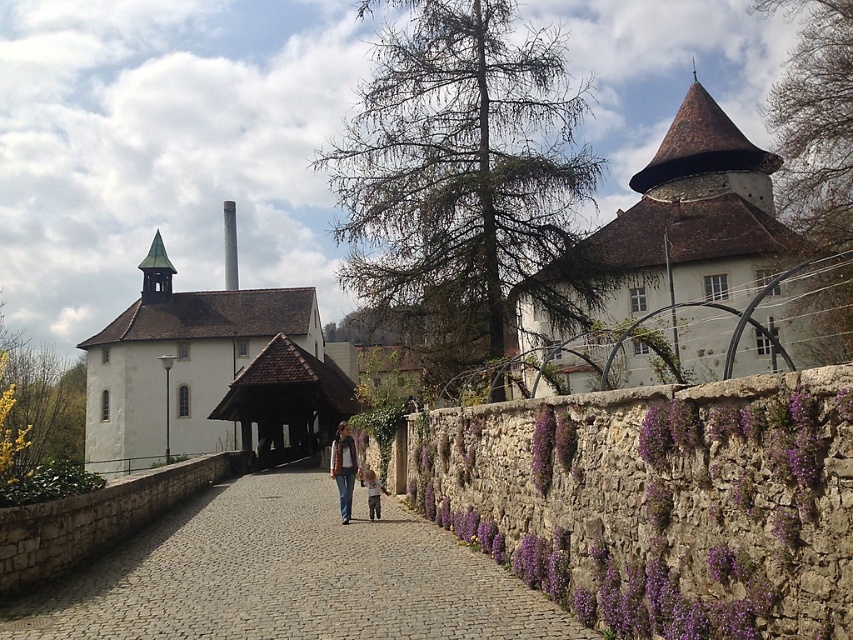
You are standing at the cobblestone pathway leading to the historic building complex. You see two points marked on the scene. Which point, point (403, 608) or point (335, 476), is closer to you?

Point (403, 608) is closer to the viewer than point (335, 476).

You are standing at the point with coordinates (287, 577) in the image. What object are you standing on?

You are standing on the gray cobblestone path at center, which is located at point (287, 577).